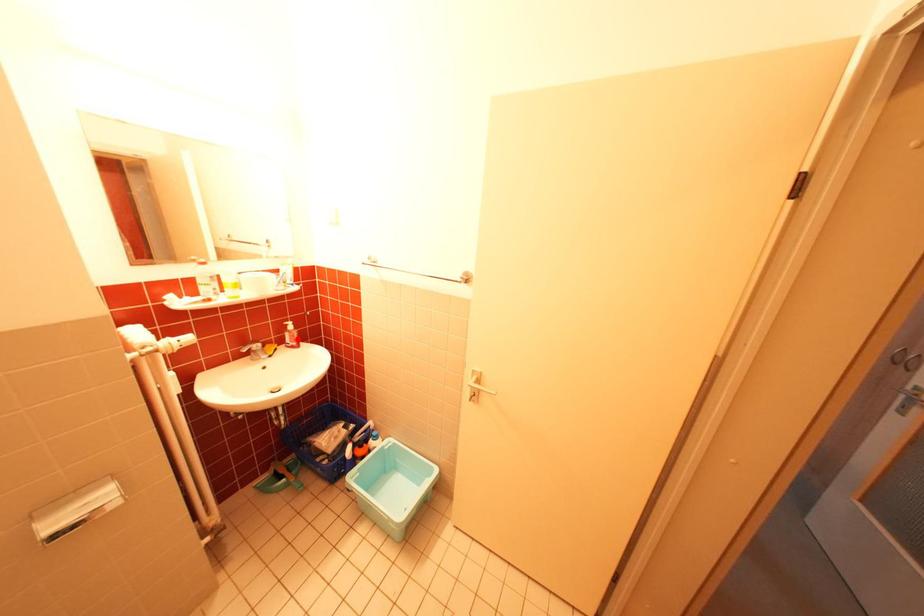
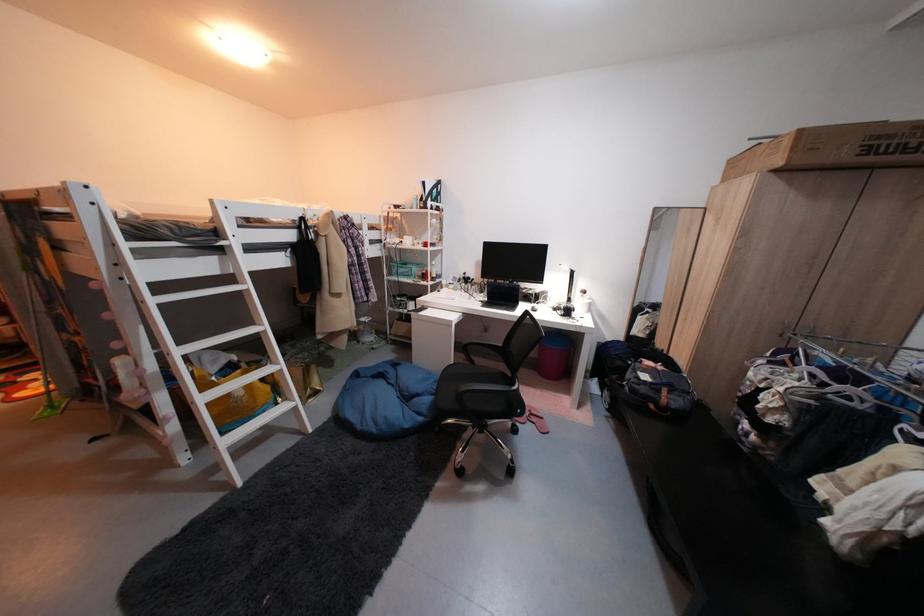
Question: I am providing you with two images of the same scene from different viewpoints. A red point is marked on the first image. Can you still see the location of the red point in image 2?

Choices:
 (A) Yes
 (B) No

Answer: (B)